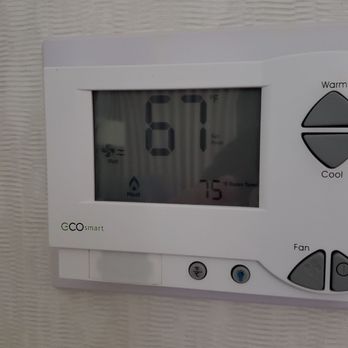
The height and width of the screenshot is (348, 348). Find the location of `wall`. wall is located at coordinates point(24,154), point(144,18), point(144,321).